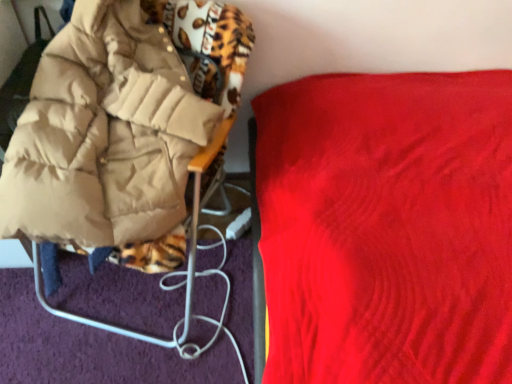
This screenshot has height=384, width=512. In order to click on velvet red blanket at upper right, placed as the 1th furniture when sorted from right to left in this screenshot , I will do point(387,227).

What do you see at coordinates (387, 227) in the screenshot?
I see `velvet red blanket at upper right, placed as the 1th furniture when sorted from right to left` at bounding box center [387, 227].

What is the approximate height of velvet red blanket at upper right, placed as the 1th furniture when sorted from right to left?

The height of velvet red blanket at upper right, placed as the 1th furniture when sorted from right to left, is 34.07 inches.

Measure the distance between point (465,268) and camera.

Point (465,268) is 34.45 inches from camera.

What do you see at coordinates (121, 131) in the screenshot? I see `matte beige jacket at left, positioned as the 1th furniture in left-to-right order` at bounding box center [121, 131].

What is the approximate height of matte beige jacket at left, arranged as the 2th furniture when viewed from the right?

The height of matte beige jacket at left, arranged as the 2th furniture when viewed from the right, is 29.40 inches.

The image size is (512, 384). Find the location of `matte beige jacket at left, positioned as the 1th furniture in left-to-right order`. matte beige jacket at left, positioned as the 1th furniture in left-to-right order is located at coordinates (121, 131).

In order to click on velvet red blanket at upper right, positioned as the 2th furniture in left-to-right order in this screenshot , I will do `click(387, 227)`.

Considering the relative positions of velvet red blanket at upper right, placed as the 1th furniture when sorted from right to left, and matte beige jacket at left, positioned as the 1th furniture in left-to-right order, in the image provided, is velvet red blanket at upper right, placed as the 1th furniture when sorted from right to left, to the left of matte beige jacket at left, positioned as the 1th furniture in left-to-right order, from the viewer's perspective?

Incorrect, velvet red blanket at upper right, placed as the 1th furniture when sorted from right to left, is not on the left side of matte beige jacket at left, positioned as the 1th furniture in left-to-right order.

Based on the photo, does velvet red blanket at upper right, placed as the 1th furniture when sorted from right to left, lie behind matte beige jacket at left, arranged as the 2th furniture when viewed from the right?

No, it is in front of matte beige jacket at left, arranged as the 2th furniture when viewed from the right.

Does point (441, 185) come farther from viewer compared to point (70, 45)?

No, (441, 185) is in front of (70, 45).

Looking at this image, from the image's perspective, which one is positioned higher, velvet red blanket at upper right, positioned as the 2th furniture in left-to-right order, or matte beige jacket at left, arranged as the 2th furniture when viewed from the right?

matte beige jacket at left, arranged as the 2th furniture when viewed from the right, appears higher in the image.

From a real-world perspective, does velvet red blanket at upper right, positioned as the 2th furniture in left-to-right order, stand above matte beige jacket at left, arranged as the 2th furniture when viewed from the right?

Yes.

Considering the sizes of objects velvet red blanket at upper right, positioned as the 2th furniture in left-to-right order, and matte beige jacket at left, positioned as the 1th furniture in left-to-right order, in the image provided, who is thinner, velvet red blanket at upper right, positioned as the 2th furniture in left-to-right order, or matte beige jacket at left, positioned as the 1th furniture in left-to-right order,?

matte beige jacket at left, positioned as the 1th furniture in left-to-right order.

Which of these two, velvet red blanket at upper right, placed as the 1th furniture when sorted from right to left, or matte beige jacket at left, positioned as the 1th furniture in left-to-right order, stands taller?

velvet red blanket at upper right, placed as the 1th furniture when sorted from right to left.

Does velvet red blanket at upper right, placed as the 1th furniture when sorted from right to left, have a smaller size compared to matte beige jacket at left, arranged as the 2th furniture when viewed from the right?

No, velvet red blanket at upper right, placed as the 1th furniture when sorted from right to left, is not smaller than matte beige jacket at left, arranged as the 2th furniture when viewed from the right.

Is matte beige jacket at left, arranged as the 2th furniture when viewed from the right, located within velvet red blanket at upper right, positioned as the 2th furniture in left-to-right order?

Actually, matte beige jacket at left, arranged as the 2th furniture when viewed from the right, is outside velvet red blanket at upper right, positioned as the 2th furniture in left-to-right order.

Are velvet red blanket at upper right, placed as the 1th furniture when sorted from right to left, and matte beige jacket at left, positioned as the 1th furniture in left-to-right order, located far from each other?

No, velvet red blanket at upper right, placed as the 1th furniture when sorted from right to left, is in close proximity to matte beige jacket at left, positioned as the 1th furniture in left-to-right order.

Is velvet red blanket at upper right, placed as the 1th furniture when sorted from right to left, looking in the opposite direction of matte beige jacket at left, arranged as the 2th furniture when viewed from the right?

velvet red blanket at upper right, placed as the 1th furniture when sorted from right to left, is not turned away from matte beige jacket at left, arranged as the 2th furniture when viewed from the right.

What's the angular difference between velvet red blanket at upper right, placed as the 1th furniture when sorted from right to left, and matte beige jacket at left, positioned as the 1th furniture in left-to-right order,'s facing directions?

82.9 degrees.

Could you measure the distance between velvet red blanket at upper right, positioned as the 2th furniture in left-to-right order, and matte beige jacket at left, positioned as the 1th furniture in left-to-right order?

velvet red blanket at upper right, positioned as the 2th furniture in left-to-right order, is 16.93 inches from matte beige jacket at left, positioned as the 1th furniture in left-to-right order.

In the image, there is a matte beige jacket at left, arranged as the 2th furniture when viewed from the right. Where is `furniture below it (from the image's perspective)`? This screenshot has width=512, height=384. furniture below it (from the image's perspective) is located at coordinates (387, 227).

Is matte beige jacket at left, positioned as the 1th furniture in left-to-right order, at the left side of velvet red blanket at upper right, positioned as the 2th furniture in left-to-right order?

Yes, matte beige jacket at left, positioned as the 1th furniture in left-to-right order, is to the left of velvet red blanket at upper right, positioned as the 2th furniture in left-to-right order.

Is matte beige jacket at left, positioned as the 1th furniture in left-to-right order, in front of velvet red blanket at upper right, positioned as the 2th furniture in left-to-right order?

No.

Is point (163, 133) in front of point (365, 352)?

No, it is not.

From the image's perspective, which is above, matte beige jacket at left, arranged as the 2th furniture when viewed from the right, or velvet red blanket at upper right, positioned as the 2th furniture in left-to-right order?

matte beige jacket at left, arranged as the 2th furniture when viewed from the right, is shown above in the image.

From a real-world perspective, which is physically above, matte beige jacket at left, positioned as the 1th furniture in left-to-right order, or velvet red blanket at upper right, positioned as the 2th furniture in left-to-right order?

velvet red blanket at upper right, positioned as the 2th furniture in left-to-right order, from a real-world perspective.

Considering the sizes of objects matte beige jacket at left, arranged as the 2th furniture when viewed from the right, and velvet red blanket at upper right, placed as the 1th furniture when sorted from right to left, in the image provided, who is thinner, matte beige jacket at left, arranged as the 2th furniture when viewed from the right, or velvet red blanket at upper right, placed as the 1th furniture when sorted from right to left,?

matte beige jacket at left, arranged as the 2th furniture when viewed from the right, is thinner.

Between matte beige jacket at left, positioned as the 1th furniture in left-to-right order, and velvet red blanket at upper right, placed as the 1th furniture when sorted from right to left, which one has less height?

matte beige jacket at left, positioned as the 1th furniture in left-to-right order, is shorter.

From the picture: Considering the sizes of objects matte beige jacket at left, arranged as the 2th furniture when viewed from the right, and velvet red blanket at upper right, positioned as the 2th furniture in left-to-right order, in the image provided, who is bigger, matte beige jacket at left, arranged as the 2th furniture when viewed from the right, or velvet red blanket at upper right, positioned as the 2th furniture in left-to-right order,?

velvet red blanket at upper right, positioned as the 2th furniture in left-to-right order, is bigger.

Can we say matte beige jacket at left, positioned as the 1th furniture in left-to-right order, lies outside velvet red blanket at upper right, positioned as the 2th furniture in left-to-right order?

Yes, matte beige jacket at left, positioned as the 1th furniture in left-to-right order, is outside of velvet red blanket at upper right, positioned as the 2th furniture in left-to-right order.

Is matte beige jacket at left, arranged as the 2th furniture when viewed from the right, not near velvet red blanket at upper right, positioned as the 2th furniture in left-to-right order?

matte beige jacket at left, arranged as the 2th furniture when viewed from the right, is actually quite close to velvet red blanket at upper right, positioned as the 2th furniture in left-to-right order.

Is matte beige jacket at left, positioned as the 1th furniture in left-to-right order, facing away from velvet red blanket at upper right, placed as the 1th furniture when sorted from right to left?

No, matte beige jacket at left, positioned as the 1th furniture in left-to-right order, is not facing away from velvet red blanket at upper right, placed as the 1th furniture when sorted from right to left.

How different are the orientations of matte beige jacket at left, arranged as the 2th furniture when viewed from the right, and velvet red blanket at upper right, placed as the 1th furniture when sorted from right to left, in degrees?

They differ by 82.9 degrees in their facing directions.

Find the location of `furniture in front of the matte beige jacket at left, arranged as the 2th furniture when viewed from the right`. furniture in front of the matte beige jacket at left, arranged as the 2th furniture when viewed from the right is located at coordinates (387, 227).

In the image, there is a velvet red blanket at upper right, placed as the 1th furniture when sorted from right to left. Where is `furniture above it (from the image's perspective)`? Image resolution: width=512 pixels, height=384 pixels. furniture above it (from the image's perspective) is located at coordinates (121, 131).

I want to click on furniture below the matte beige jacket at left, arranged as the 2th furniture when viewed from the right (from the image's perspective), so click(387, 227).